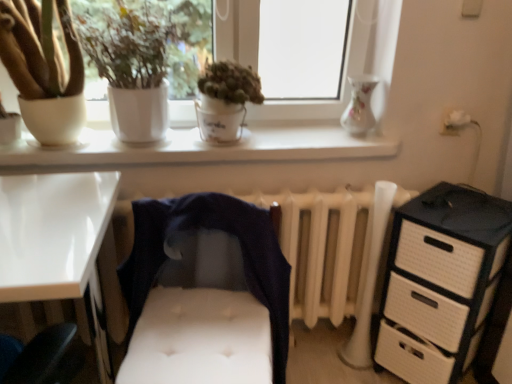
Question: Would you say white glossy desk at lower left is part of green matte plant at center, placed as the 1th houseplant when sorted from right to left,'s contents?

Choices:
 (A) yes
 (B) no

Answer: (B)

Question: Is green matte plant at center, acting as the third houseplant starting from the left, bigger than white glossy desk at lower left?

Choices:
 (A) no
 (B) yes

Answer: (A)

Question: Is green matte plant at center, placed as the 1th houseplant when sorted from right to left, to the right of white glossy desk at lower left from the viewer's perspective?

Choices:
 (A) yes
 (B) no

Answer: (A)

Question: Is green matte plant at center, acting as the third houseplant starting from the left, thinner than white glossy desk at lower left?

Choices:
 (A) no
 (B) yes

Answer: (B)

Question: From a real-world perspective, is green matte plant at center, acting as the third houseplant starting from the left, below white glossy desk at lower left?

Choices:
 (A) yes
 (B) no

Answer: (B)

Question: Is point (32, 44) positioned closer to the camera than point (83, 157)?

Choices:
 (A) farther
 (B) closer

Answer: (B)

Question: Considering their positions, is matte white pot at left, the 3th houseplant viewed from the right, located in front of or behind white glossy window at upper center?

Choices:
 (A) front
 (B) behind

Answer: (A)

Question: From the image's perspective, relative to white glossy window at upper center, is matte white pot at left, the 3th houseplant viewed from the right, above or below?

Choices:
 (A) below
 (B) above

Answer: (A)

Question: Is matte white pot at left, the 3th houseplant viewed from the right, spatially inside white glossy window at upper center, or outside of it?

Choices:
 (A) outside
 (B) inside

Answer: (B)

Question: Is point (58, 203) closer or farther from the camera than point (22, 84)?

Choices:
 (A) farther
 (B) closer

Answer: (B)

Question: Considering their positions, is white glossy desk at lower left located in front of or behind matte white pot at left, positioned as the 1th houseplant in left-to-right order?

Choices:
 (A) behind
 (B) front

Answer: (B)

Question: Is white glossy desk at lower left inside or outside of matte white pot at left, positioned as the 1th houseplant in left-to-right order?

Choices:
 (A) inside
 (B) outside

Answer: (B)

Question: Considering the positions of white glossy desk at lower left and matte white pot at left, the 3th houseplant viewed from the right, in the image, is white glossy desk at lower left taller or shorter than matte white pot at left, the 3th houseplant viewed from the right,?

Choices:
 (A) tall
 (B) short

Answer: (A)

Question: Is white glossy window sill at upper center inside or outside of white matte pot at upper left, which is the second houseplant from left to right?

Choices:
 (A) inside
 (B) outside

Answer: (B)

Question: Considering their positions, is white glossy window sill at upper center located in front of or behind white matte pot at upper left, which is the second houseplant from left to right?

Choices:
 (A) behind
 (B) front

Answer: (A)